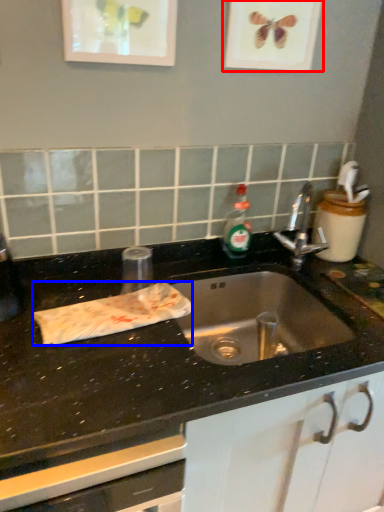
Question: Which object appears closest to the camera in this image, picture frame (highlighted by a red box) or material (highlighted by a blue box)?

Choices:
 (A) picture frame
 (B) material

Answer: (B)